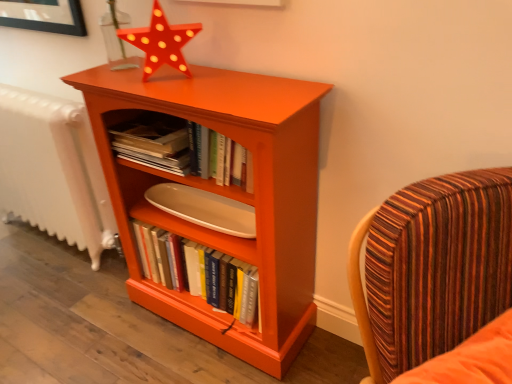
You are a GUI agent. You are given a task and a screenshot of the screen. Output one action in this format:
    pyautogui.click(x=<x>, y=<y>)
    Task: Click on the free space on the front side of white textured radiator at left
    This screenshot has width=512, height=384.
    Given the screenshot: What is the action you would take?
    pyautogui.click(x=64, y=306)